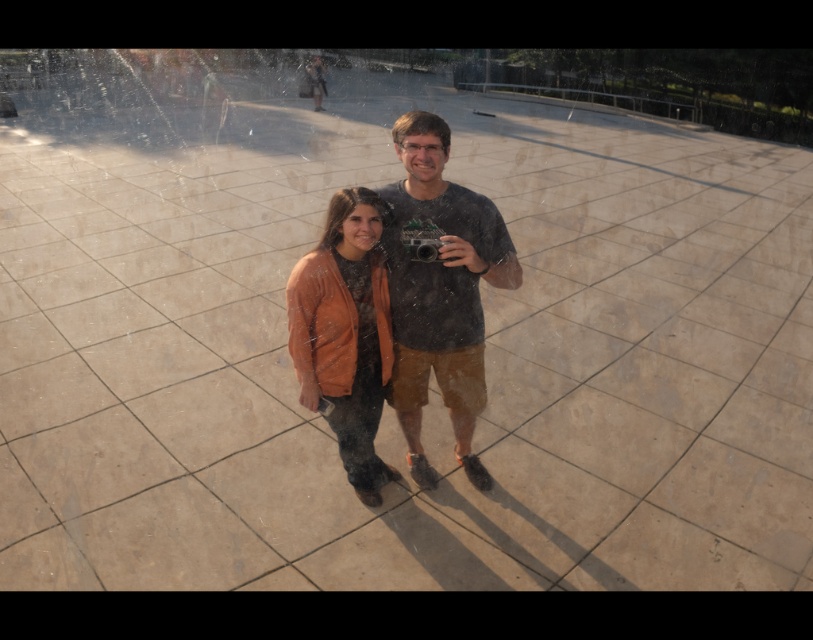
Question: Which point is closer to the camera?

Choices:
 (A) matte black t-shirt at center
 (B) matte orange jacket at center

Answer: (A)

Question: Does matte black t-shirt at center have a smaller size compared to matte orange jacket at center?

Choices:
 (A) no
 (B) yes

Answer: (A)

Question: Among these points, which one is farthest from the camera?

Choices:
 (A) (409, 198)
 (B) (357, 324)

Answer: (A)

Question: Does matte black t-shirt at center have a smaller size compared to matte orange jacket at center?

Choices:
 (A) no
 (B) yes

Answer: (A)

Question: In this image, where is matte black t-shirt at center located relative to matte orange jacket at center?

Choices:
 (A) above
 (B) below

Answer: (A)